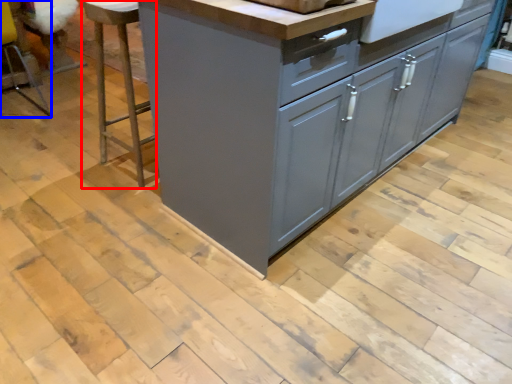
Question: Which point is closer to the camera, bar stool (highlighted by a red box) or bar stool (highlighted by a blue box)?

Choices:
 (A) bar stool
 (B) bar stool

Answer: (A)